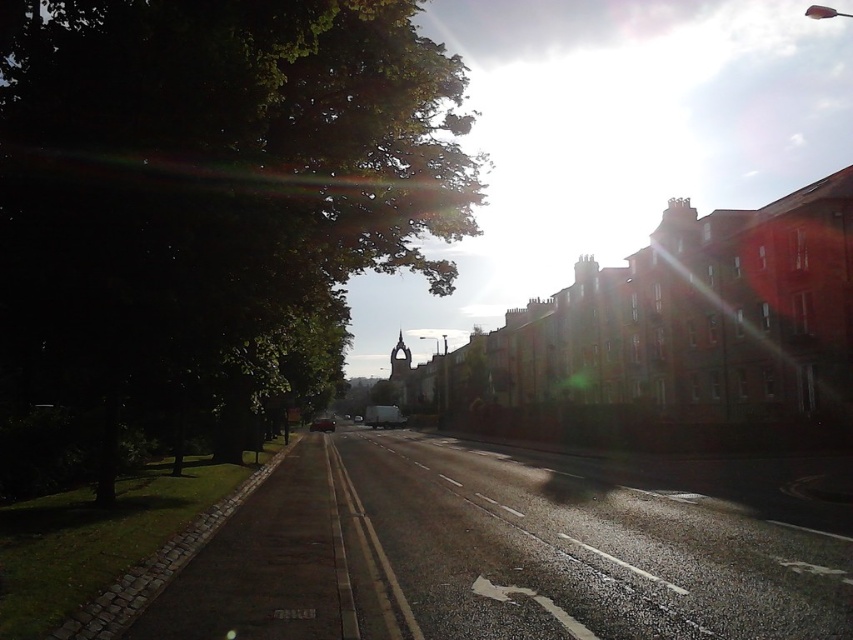
Question: Among these points, which one is nearest to the camera?

Choices:
 (A) (167, 396)
 (B) (390, 422)
 (C) (358, 417)

Answer: (A)

Question: Does metallic silver car at center appear under metallic silver van at center?

Choices:
 (A) no
 (B) yes

Answer: (A)

Question: Is shiny silver van at center above shiny silver car at center?

Choices:
 (A) yes
 (B) no

Answer: (A)

Question: Is green leafy tree at left behind shiny silver van at center?

Choices:
 (A) yes
 (B) no

Answer: (B)

Question: Which point appears closest to the camera in this image?

Choices:
 (A) (355, 419)
 (B) (329, 428)
 (C) (393, 406)
 (D) (344, 417)

Answer: (B)

Question: Which object is closer to the camera taking this photo?

Choices:
 (A) metallic silver van at center
 (B) green leafy tree at left
 (C) shiny silver van at center
 (D) metallic silver car at center

Answer: (B)